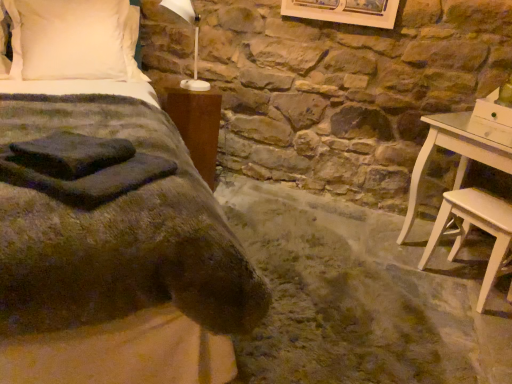
Locate an element on the screen. free space above light wood stool at lower right (from a real-world perspective) is located at coordinates (486, 207).